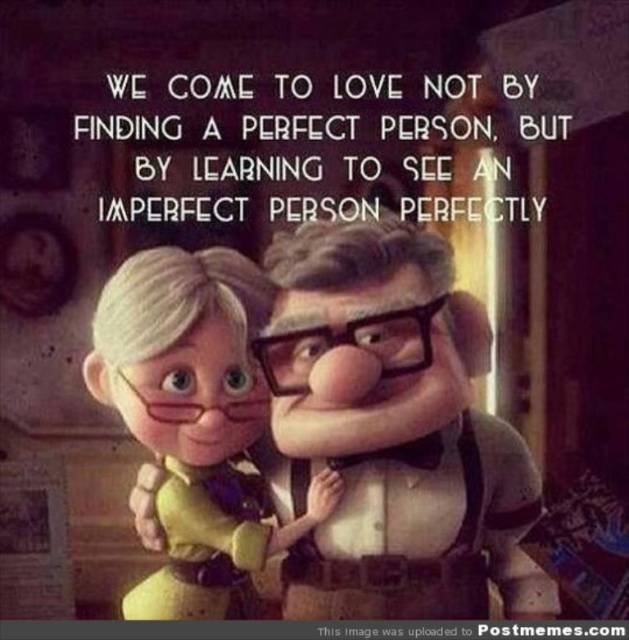
Between point (213, 378) and point (126, 204), which one is positioned behind?

The point (126, 204) is behind.

Does point (159, 577) come in front of point (470, 163)?

That is True.

Where is `matte yellow dress at center`? matte yellow dress at center is located at coordinates (194, 420).